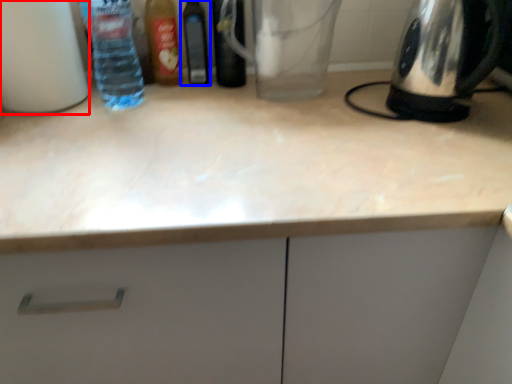
Question: Which point is further to the camera, bottle (highlighted by a red box) or bottle (highlighted by a blue box)?

Choices:
 (A) bottle
 (B) bottle

Answer: (B)